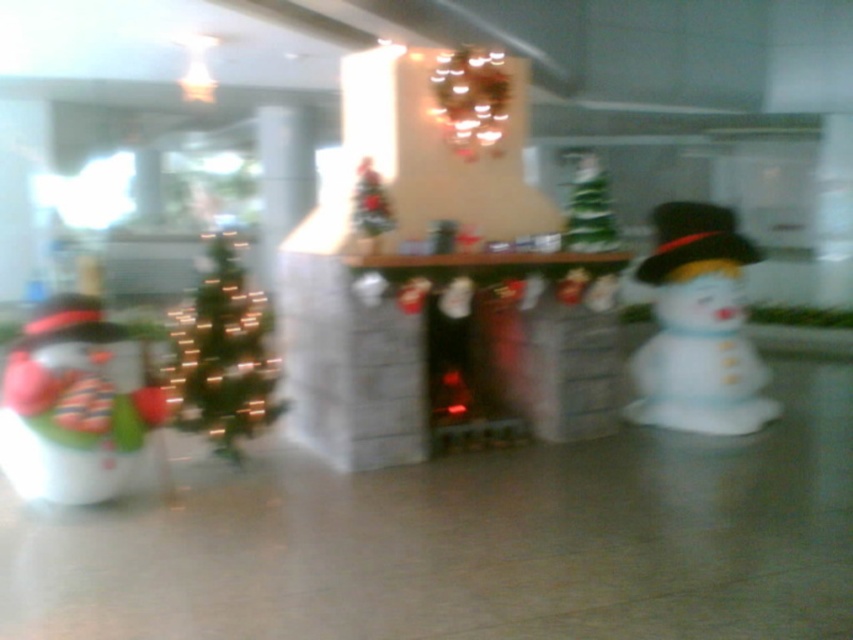
You are a delivery person who needs to place a package between the matte white snowman at left and the green matte christmas tree at center. The package requires 6 feet of space. Can you fit it there?

The matte white snowman at left is 7.24 feet away from the green matte christmas tree at center, so yes, the package requiring 6 feet of space can fit between them since the distance is sufficient.

You are standing in the lobby and want to place a new decoration exactly at the center of the image. The center is defined as the point where the coordinates are both 0.5. Given that the white glossy snowman at right is located at coordinates 0.512, 0.819, how far vertically and horizontally is it from the center?

The white glossy snowman at right is located at coordinates [698,326]. The center is at [426,320]. Horizontally, the difference is 0.512 minus 0.5 equals 0.012 units to the right. Vertically, the difference is 0.819 minus 0.5 equals 0.319 units above the center.

You are a photographer trying to capture a clear shot of both the white glossy snowman at right and the green matte christmas tree at left. Based on their positions, which one should you focus on first if you want to ensure both are in focus?

The white glossy snowman at right is located above the green matte christmas tree at left, so you should focus on the white glossy snowman at right first to ensure both are in focus since it is higher up.